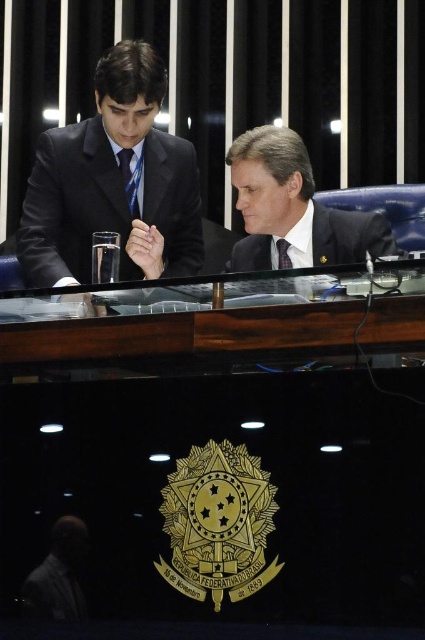
You are organizing a meeting and need to seat two guests based on their attire. The matte black suit at left and the black silk suit at center are present. Which guest should you seat closer to the entrance if seating is determined by the size of their attire?

The matte black suit at left has a larger size compared to the black silk suit at center, so you should seat the guest in the matte black suit at left closer to the entrance since larger attire typically requires more space.

You are standing in front of the desk and want to place a small object on the surface. Which of the two points, point (331, 234) or point (348, 259), is closer to you?

Point (331, 234) is further to the camera than point (348, 259), so the point closer to you is point (348, 259).